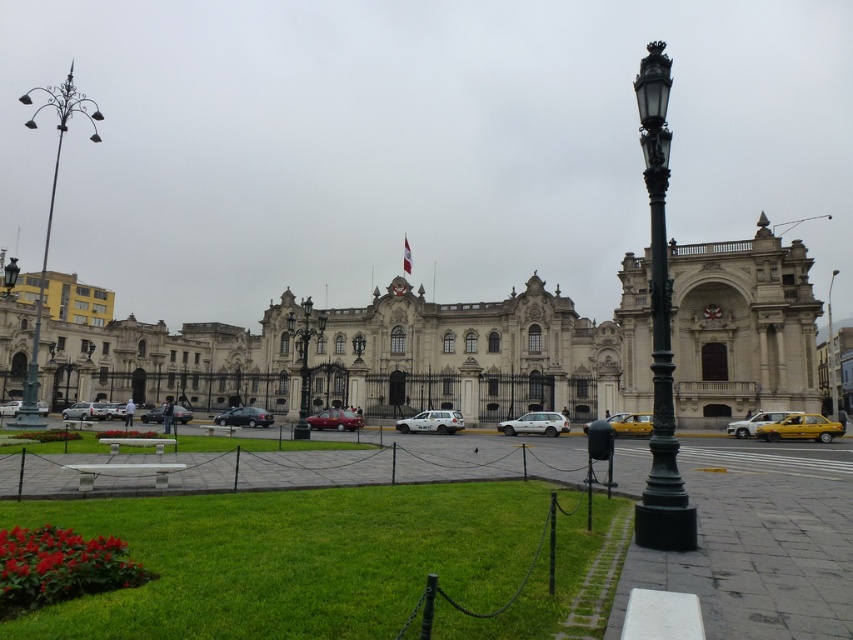
Which is more to the left, polished metal streetlamp at left or yellow matte taxi at right?

From the viewer's perspective, polished metal streetlamp at left appears more on the left side.

Can you confirm if polished metal streetlamp at left is taller than yellow matte taxi at right?

Yes, polished metal streetlamp at left is taller than yellow matte taxi at right.

Between point (39, 314) and point (756, 422), which one is positioned in front?

Positioned in front is point (756, 422).

Identify the location of polished metal streetlamp at left. Image resolution: width=853 pixels, height=640 pixels. (49, 227).

Does point (38, 296) come closer to viewer compared to point (544, 424)?

No, it is not.

Does point (49, 232) come behind point (535, 428)?

Yes, point (49, 232) is farther from viewer.

Locate an element on the screen. The height and width of the screenshot is (640, 853). green painted metal pole at left is located at coordinates (38, 321).

Consider the image. Between green painted metal pole at left and matte silver sedan at center-left, which one has less height?

With less height is matte silver sedan at center-left.

Does green painted metal pole at left lie behind matte silver sedan at center-left?

No, green painted metal pole at left is closer to the viewer.

Does point (26, 122) come behind point (74, 403)?

Yes, it is.

Identify the location of green painted metal pole at left. (38, 321).